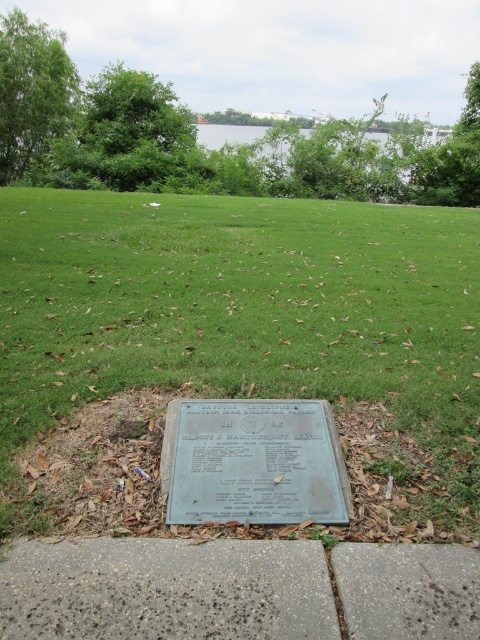
You are a gardener who needs to water the green grass at center and the green polished stone plaque at center. Your watering can has a range of 2 meters. Can you water both objects without moving your position?

The distance between the green grass at center and the green polished stone plaque at center is 2.69 meters. Since your watering can only reaches 2 meters, you cannot water both objects without moving your position.

You are standing on the gray concrete pavement at lower center and want to walk to the plaque. Which direction should you move to reach the plaque, considering the green grass at center is to your right?

Since the green grass at center is to the right of the gray concrete pavement at lower center, you should move to your left to reach the plaque located in the grass area.

You are standing at the edge of the grassy area and want to walk to the gray concrete pavement at lower center. What direction should you walk to reach it?

Since the gray concrete pavement at lower center is located at point (x=167, y=589) in 2D coordinates, you should walk towards the lower center direction to reach it.